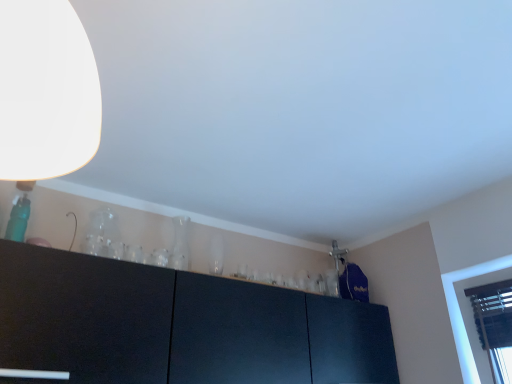
Question: Is transparent glass vase at upper center, acting as the second glass vase starting from the right, facing away from transparent glass vase at center, positioned as the first glass vase in back-to-front order?

Choices:
 (A) yes
 (B) no

Answer: (B)

Question: Is transparent glass vase at upper center, positioned as the 1th glass vase in left-to-right order, facing towards transparent glass vase at center, the 2th glass vase viewed from the front?

Choices:
 (A) yes
 (B) no

Answer: (B)

Question: Does transparent glass vase at upper center, acting as the second glass vase starting from the right, have a lesser height compared to transparent glass vase at center, marked as the 1th glass vase in a right-to-left arrangement?

Choices:
 (A) yes
 (B) no

Answer: (A)

Question: Considering the relative positions of transparent glass vase at upper center, acting as the second glass vase starting from the right, and transparent glass vase at center, marked as the 1th glass vase in a right-to-left arrangement, in the image provided, is transparent glass vase at upper center, acting as the second glass vase starting from the right, to the left of transparent glass vase at center, marked as the 1th glass vase in a right-to-left arrangement, from the viewer's perspective?

Choices:
 (A) yes
 (B) no

Answer: (A)

Question: From the image's perspective, does transparent glass vase at upper center, acting as the second glass vase starting from the right, appear higher than transparent glass vase at center, positioned as the first glass vase in back-to-front order?

Choices:
 (A) no
 (B) yes

Answer: (B)

Question: Is transparent glass vase at upper center, positioned as the 1th glass vase in left-to-right order, bigger than transparent glass vase at center, marked as the 1th glass vase in a right-to-left arrangement?

Choices:
 (A) yes
 (B) no

Answer: (B)

Question: Can you confirm if transparent glass vase at center, the 2th glass vase viewed from the front, is taller than white matte lampshade at upper left?

Choices:
 (A) yes
 (B) no

Answer: (B)

Question: From the image's perspective, would you say transparent glass vase at center, marked as the 1th glass vase in a right-to-left arrangement, is shown under white matte lampshade at upper left?

Choices:
 (A) no
 (B) yes

Answer: (B)

Question: Considering the relative positions of transparent glass vase at center, positioned as the first glass vase in back-to-front order, and white matte lampshade at upper left in the image provided, is transparent glass vase at center, positioned as the first glass vase in back-to-front order, to the right of white matte lampshade at upper left from the viewer's perspective?

Choices:
 (A) no
 (B) yes

Answer: (A)

Question: Does transparent glass vase at center, marked as the 1th glass vase in a right-to-left arrangement, have a smaller size compared to white matte lampshade at upper left?

Choices:
 (A) no
 (B) yes

Answer: (B)

Question: Could you tell me if transparent glass vase at center, marked as the 1th glass vase in a right-to-left arrangement, is turned towards white matte lampshade at upper left?

Choices:
 (A) no
 (B) yes

Answer: (A)

Question: Can you see transparent glass vase at center, the second glass vase from the left, touching white matte lampshade at upper left?

Choices:
 (A) yes
 (B) no

Answer: (B)

Question: Is transparent glass vase at center, marked as the 1th glass vase in a right-to-left arrangement, bigger than transparent glass vase at upper center, the 2th glass vase in the back-to-front sequence?

Choices:
 (A) yes
 (B) no

Answer: (A)